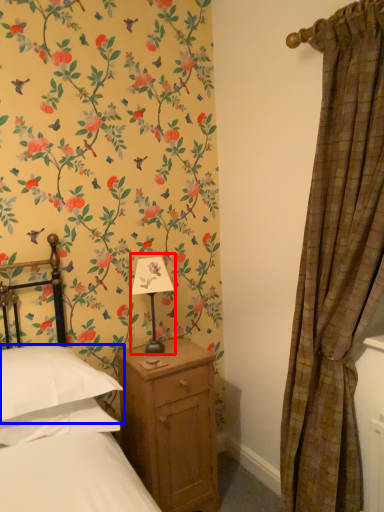
Question: Which of the following is the closest to the observer, table lamp (highlighted by a red box) or pillow (highlighted by a blue box)?

Choices:
 (A) table lamp
 (B) pillow

Answer: (B)